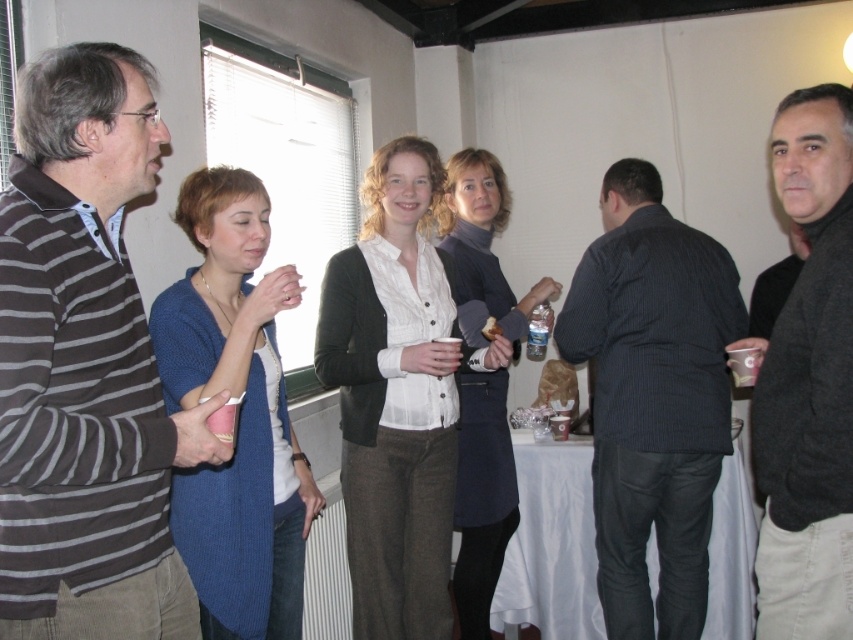
You are a photographer setting up a photo shoot in the room. You need to arrange two sweaters, the blue knitted sweater at center and the dark gray sweater at center, on a shelf. The shelf has limited vertical space. Which sweater should you place first to ensure both fit vertically?

The blue knitted sweater at center has a lesser height compared to the dark gray sweater at center, so place the taller dark gray sweater at center first, then the shorter blue knitted sweater at center to ensure both fit vertically.

Based on the photo, you are a photographer taking a picture of the scene. You want to ensure both the matte white blouse at center and the clear plastic cup at upper right are in focus. Which object should you adjust your camera focus to first to ensure both are sharp?

You should focus on the matte white blouse at center first because it is closer to the camera than the clear plastic cup at upper right. Since it is closer, adjusting focus starting there ensures the background object will also be in focus.

You are standing in the room and want to hand a gift to the person wearing the dark gray sweater at center without disturbing the person in the blue knitted sweater at center. How can you do this?

Since the blue knitted sweater at center is above the dark gray sweater at center, you can reach below the blue knitted sweater at center to hand the gift to the person wearing the dark gray sweater at center without disturbing them.